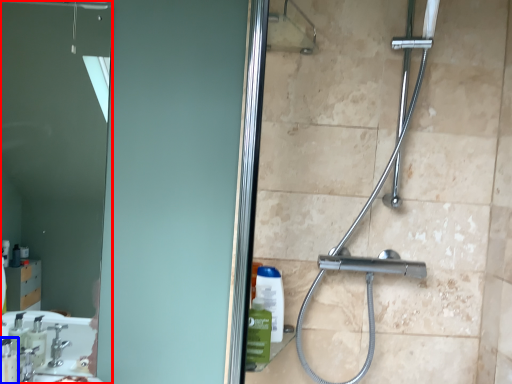
Question: Which point is closer to the camera, mirror (highlighted by a red box) or soap dispenser (highlighted by a blue box)?

Choices:
 (A) mirror
 (B) soap dispenser

Answer: (B)